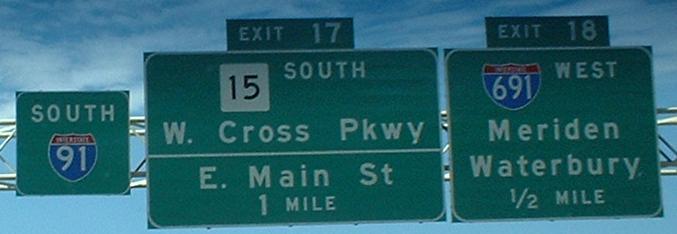
I want to click on exit sign, so pos(260,36), pos(519,31).